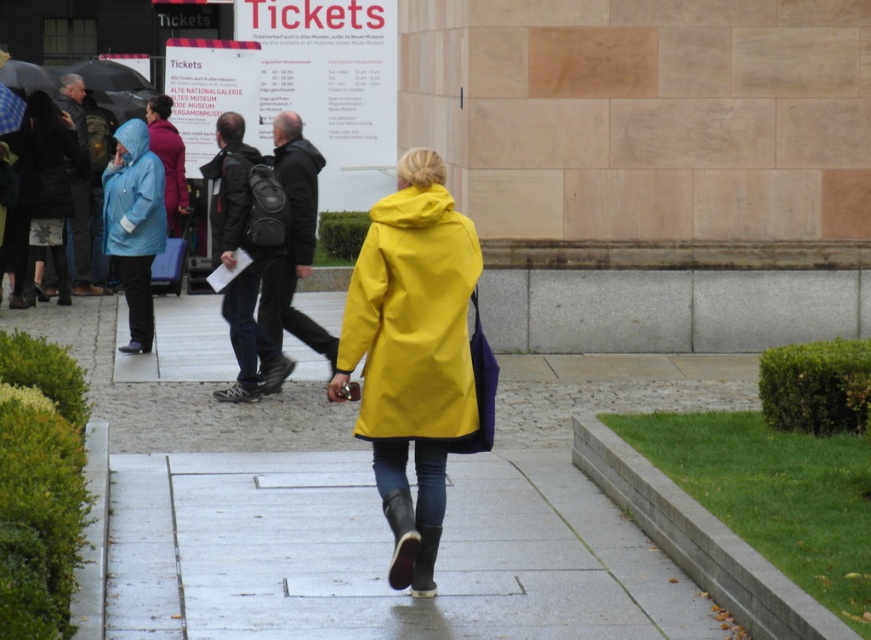
How far apart are matte blue raincoat at left and dark gray textured jacket at center?

matte blue raincoat at left is 4.64 meters away from dark gray textured jacket at center.

Which is more to the right, matte blue raincoat at left or dark gray textured jacket at center?

From the viewer's perspective, dark gray textured jacket at center appears more on the right side.

Does point (26, 147) come farther from viewer compared to point (241, 225)?

That is True.

The width and height of the screenshot is (871, 640). I want to click on matte blue raincoat at left, so click(44, 189).

This screenshot has height=640, width=871. Identify the location of yellow matte raincoat at center. click(x=412, y=320).

Can you confirm if yellow matte raincoat at center is positioned to the left of matte black coat at center?

Incorrect, yellow matte raincoat at center is not on the left side of matte black coat at center.

What do you see at coordinates (412, 320) in the screenshot? I see `yellow matte raincoat at center` at bounding box center [412, 320].

The width and height of the screenshot is (871, 640). I want to click on yellow matte raincoat at center, so click(x=412, y=320).

Can you confirm if smooth concrete pavement at center is bigger than matte blue raincoat at left?

Indeed, smooth concrete pavement at center has a larger size compared to matte blue raincoat at left.

Between smooth concrete pavement at center and matte blue raincoat at left, which one is positioned lower?

smooth concrete pavement at center is below.

Which is in front, point (537, 586) or point (44, 172)?

Point (537, 586) is more forward.

I want to click on smooth concrete pavement at center, so click(x=380, y=556).